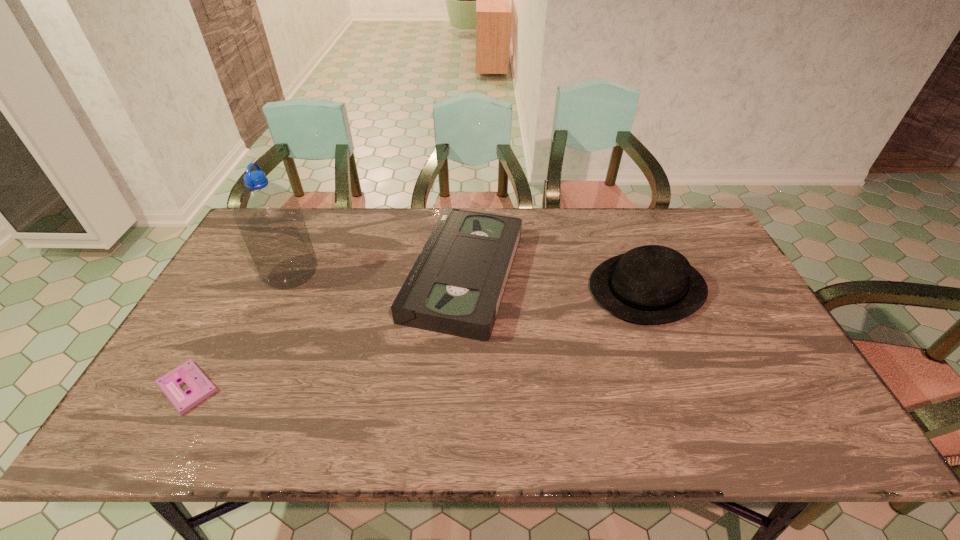
At what (x,y) coordinates should I click in order to perform the action: click on object that is the closest to the tallest object. Please return your answer as a coordinate pair (x, y). Looking at the image, I should click on (200, 387).

Identify the location of free location that satisfies the following two spatial constraints: 1. on the back side of the left videotape; 2. on the right side of the rightmost object. (243, 288).